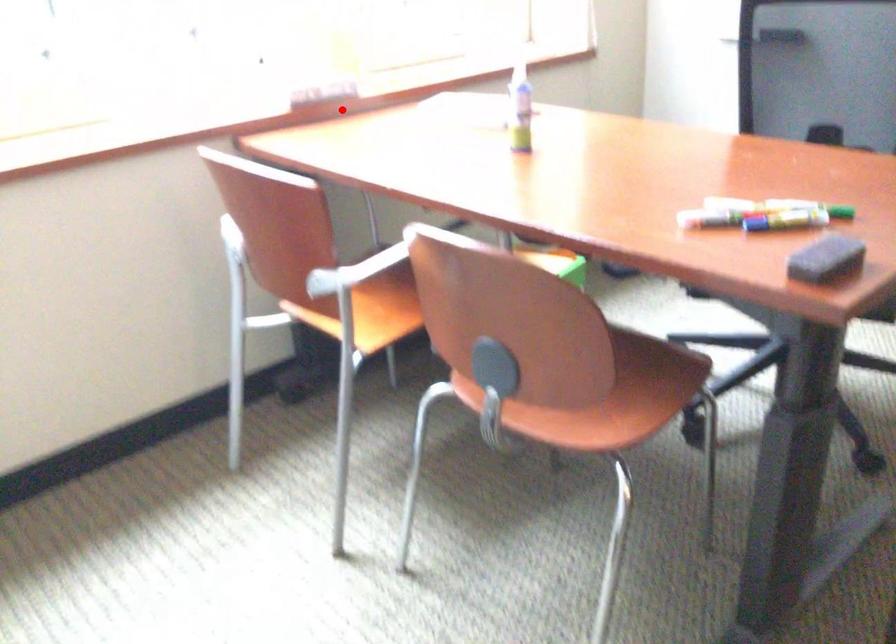
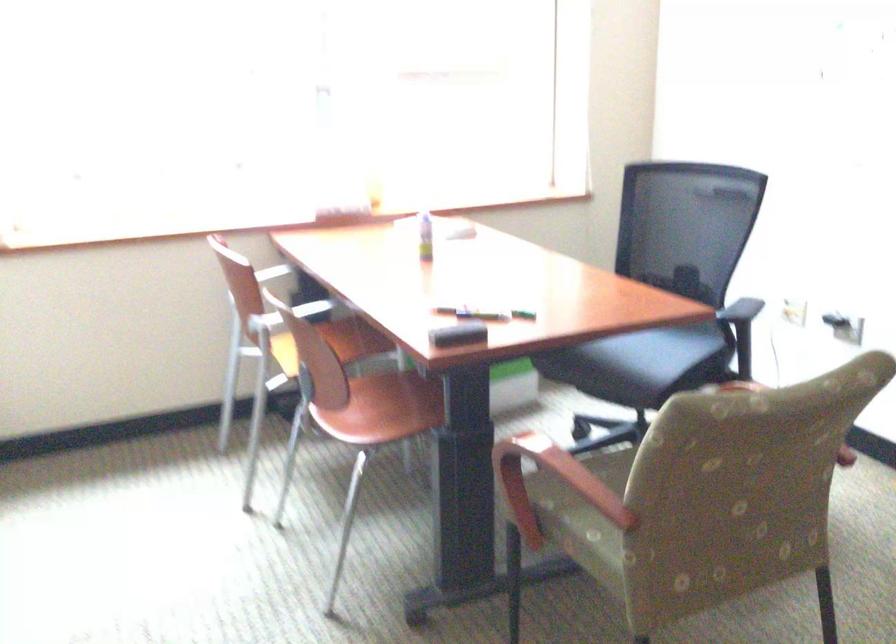
In the second image, find the point that corresponds to the highlighted location in the first image.

(346, 214)